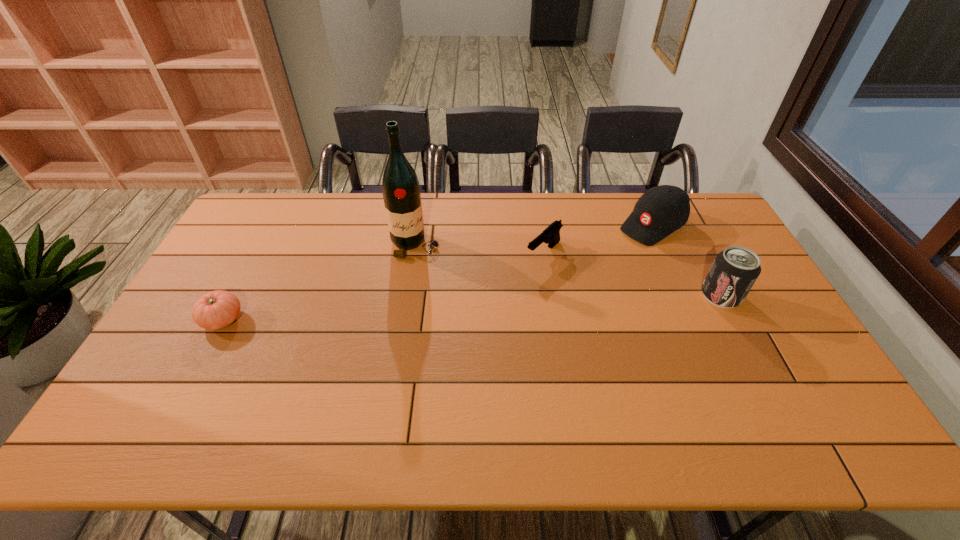
At what (x,y) coordinates should I click in order to perform the action: click on vacant space situated 0.360m on the front-facing side of the third object from right to left. Please return your answer as a coordinate pair (x, y). Looking at the image, I should click on click(456, 332).

You are a GUI agent. You are given a task and a screenshot of the screen. Output one action in this format:
    pyautogui.click(x=<x>, y=<y>)
    Task: Click on the free space located on the surface of the tallest object
    The height and width of the screenshot is (540, 960).
    Given the screenshot: What is the action you would take?
    pyautogui.click(x=463, y=349)

You are a GUI agent. You are given a task and a screenshot of the screen. Output one action in this format:
    pyautogui.click(x=<x>, y=<y>)
    Task: Click on the free location located 0.260m on the surface of the tallest object
    
    Given the screenshot: What is the action you would take?
    pyautogui.click(x=448, y=317)

At what (x,y) coordinates should I click in order to perform the action: click on free space located on the surface of the tallest object. Please return your answer as a coordinate pair (x, y). This screenshot has height=540, width=960. Looking at the image, I should click on (436, 291).

The height and width of the screenshot is (540, 960). Find the location of `vacant space located with a logo on the front of the third tallest object`. vacant space located with a logo on the front of the third tallest object is located at coordinates (577, 273).

Locate an element on the screen. free location located 0.240m with a logo on the front of the third tallest object is located at coordinates (584, 269).

You are a GUI agent. You are given a task and a screenshot of the screen. Output one action in this format:
    pyautogui.click(x=<x>, y=<y>)
    Task: Click on the vacant space located with a logo on the front of the third tallest object
    Image resolution: width=960 pixels, height=540 pixels.
    Given the screenshot: What is the action you would take?
    pyautogui.click(x=620, y=246)

At what (x,y) coordinates should I click in order to perform the action: click on wine bottle present at the far edge. Please return your answer as a coordinate pair (x, y). The image size is (960, 540). Looking at the image, I should click on (400, 187).

This screenshot has width=960, height=540. In order to click on baseball cap positioned at the far edge in this screenshot , I will do `click(661, 210)`.

Identify the location of object that is at the left edge. This screenshot has width=960, height=540. (217, 309).